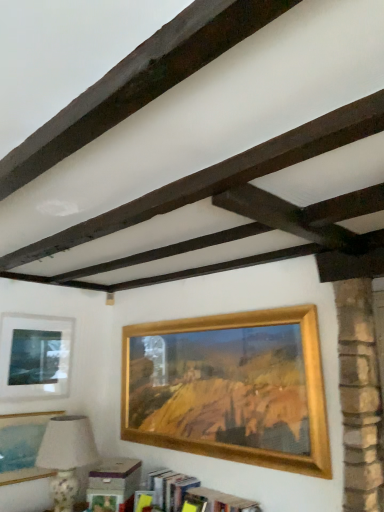
Describe the element at coordinates (118, 487) in the screenshot. I see `wooden bookshelf at lower center` at that location.

In order to face gold wooden picture frame at center, marked as the first picture frame in a right-to-left arrangement, should I rotate leftwards or rightwards?

Turn right approximately 1.000 degrees to face it.

This screenshot has width=384, height=512. Describe the element at coordinates (230, 388) in the screenshot. I see `gold wooden picture frame at center, marked as the first picture frame in a right-to-left arrangement` at that location.

Measure the distance between point (25, 383) and camera.

Point (25, 383) is 3.00 meters from camera.

The width and height of the screenshot is (384, 512). What do you see at coordinates (139, 81) in the screenshot?
I see `dark brown wood at upper center` at bounding box center [139, 81].

What do you see at coordinates (22, 446) in the screenshot? I see `matte gold picture frame at lower left, arranged as the 2th picture frame when viewed from the right` at bounding box center [22, 446].

I want to click on wooden bookshelf at lower center, so click(x=118, y=487).

From the picture: Could you tell me if matte gold picture frame at lower left, arranged as the 2th picture frame when viewed from the right, is facing dark brown wood at upper center?

No, matte gold picture frame at lower left, arranged as the 2th picture frame when viewed from the right, does not turn towards dark brown wood at upper center.

Can you confirm if matte gold picture frame at lower left, arranged as the 2th picture frame when viewed from the right, is positioned to the right of dark brown wood at upper center?

No.

Which of these two, matte gold picture frame at lower left, which is the second picture frame from left to right, or dark brown wood at upper center, is wider?

With larger width is dark brown wood at upper center.

Who is shorter, matte gold picture frame at lower left, which is the second picture frame from left to right, or dark brown wood at upper center?

dark brown wood at upper center is shorter.

Between matte gold picture frame at lower left, arranged as the 2th picture frame when viewed from the right, and wooden bookshelf at lower center, which one has larger size?

wooden bookshelf at lower center.

Which is closer to the camera, (20, 426) or (233, 503)?

Clearly, point (20, 426) is more distant from the camera than point (233, 503).

In the scene shown: Is matte gold picture frame at lower left, which is the second picture frame from left to right, surrounding wooden bookshelf at lower center?

No, wooden bookshelf at lower center is not a part of matte gold picture frame at lower left, which is the second picture frame from left to right.

Could you tell me if matte gold picture frame at lower left, which is the second picture frame from left to right, is turned towards wooden bookshelf at lower center?

Yes.

Is porcelain floral table lamp at lower left oriented away from matte gold picture frame at lower left, arranged as the 2th picture frame when viewed from the right?

No, porcelain floral table lamp at lower left's orientation is not away from matte gold picture frame at lower left, arranged as the 2th picture frame when viewed from the right.

Is porcelain floral table lamp at lower left taller than matte gold picture frame at lower left, arranged as the 2th picture frame when viewed from the right?

Yes, porcelain floral table lamp at lower left is taller than matte gold picture frame at lower left, arranged as the 2th picture frame when viewed from the right.

Is point (54, 504) closer or farther from the camera than point (11, 476)?

Point (54, 504) is closer to the camera than point (11, 476).

From a real-world perspective, is porcelain floral table lamp at lower left located beneath matte gold picture frame at lower left, which is the second picture frame from left to right?

Yes.

Which is behind, point (116, 117) or point (65, 450)?

The point (65, 450) is farther.

The width and height of the screenshot is (384, 512). Find the location of `table lamp below the dark brown wood at upper center (from a real-world perspective)`. table lamp below the dark brown wood at upper center (from a real-world perspective) is located at coordinates (66, 456).

Is porcelain floral table lamp at lower left a part of dark brown wood at upper center?

No, porcelain floral table lamp at lower left is not a part of dark brown wood at upper center.

Does dark brown wood at upper center have a larger size compared to porcelain floral table lamp at lower left?

Incorrect, dark brown wood at upper center is not larger than porcelain floral table lamp at lower left.

From a real-world perspective, between wooden bookshelf at lower center and matte gold picture frame at lower left, arranged as the 2th picture frame when viewed from the right, who is vertically lower?

From a 3D spatial view, wooden bookshelf at lower center is below.

Is wooden bookshelf at lower center bigger than matte gold picture frame at lower left, which is the second picture frame from left to right?

Correct, wooden bookshelf at lower center is larger in size than matte gold picture frame at lower left, which is the second picture frame from left to right.

Is point (242, 511) behind point (35, 477)?

No, it is in front of (35, 477).

What's the angular difference between wooden bookshelf at lower center and matte gold picture frame at lower left, arranged as the 2th picture frame when viewed from the right,'s facing directions?

They differ by 92.6 degrees in their facing directions.

Considering the relative sizes of gold wooden picture frame at center, marked as the first picture frame in a right-to-left arrangement, and matte gold picture frame at lower left, which is the second picture frame from left to right, in the image provided, is gold wooden picture frame at center, marked as the first picture frame in a right-to-left arrangement, wider than matte gold picture frame at lower left, which is the second picture frame from left to right,?

Indeed, gold wooden picture frame at center, marked as the first picture frame in a right-to-left arrangement, has a greater width compared to matte gold picture frame at lower left, which is the second picture frame from left to right.

Looking at this image, which object is more forward, gold wooden picture frame at center, marked as the first picture frame in a right-to-left arrangement, or matte gold picture frame at lower left, which is the second picture frame from left to right?

gold wooden picture frame at center, marked as the first picture frame in a right-to-left arrangement.

Which point is more forward, (188, 396) or (39, 421)?

Point (188, 396)

Does gold wooden picture frame at center, marked as the 3th picture frame in a left-to-right arrangement, have a greater height compared to matte gold picture frame at lower left, which is the second picture frame from left to right?

Yes, gold wooden picture frame at center, marked as the 3th picture frame in a left-to-right arrangement, is taller than matte gold picture frame at lower left, which is the second picture frame from left to right.

From the picture: Is matte glass picture frame at upper left, the third picture frame when ordered from right to left, turned away from dark brown wood at upper center?

No, dark brown wood at upper center is not at the back of matte glass picture frame at upper left, the third picture frame when ordered from right to left.

Considering the sizes of objects matte glass picture frame at upper left, the 1th picture frame from the left, and dark brown wood at upper center in the image provided, who is taller, matte glass picture frame at upper left, the 1th picture frame from the left, or dark brown wood at upper center?

matte glass picture frame at upper left, the 1th picture frame from the left, is taller.

Locate an element on the screen. plank in front of the matte glass picture frame at upper left, the 1th picture frame from the left is located at coordinates (139, 81).

Locate an element on the screen. Image resolution: width=384 pixels, height=512 pixels. plank on the right of matte gold picture frame at lower left, arranged as the 2th picture frame when viewed from the right is located at coordinates (139, 81).

Image resolution: width=384 pixels, height=512 pixels. I want to click on bookcase directly beneath the matte gold picture frame at lower left, arranged as the 2th picture frame when viewed from the right (from a real-world perspective), so click(118, 487).

Looking at the image, which one is located closer to wooden bookshelf at lower center, matte glass picture frame at upper left, the 1th picture frame from the left, or dark brown wood at upper center?

Among the two, matte glass picture frame at upper left, the 1th picture frame from the left, is located nearer to wooden bookshelf at lower center.

Considering their positions, is matte glass picture frame at upper left, the third picture frame when ordered from right to left, positioned further to porcelain floral table lamp at lower left than gold wooden picture frame at center, marked as the 3th picture frame in a left-to-right arrangement?

Among the two, gold wooden picture frame at center, marked as the 3th picture frame in a left-to-right arrangement, is located further to porcelain floral table lamp at lower left.

Based on their spatial positions, is matte glass picture frame at upper left, the third picture frame when ordered from right to left, or matte gold picture frame at lower left, which is the second picture frame from left to right, further from dark brown wood at upper center?

The object further to dark brown wood at upper center is matte gold picture frame at lower left, which is the second picture frame from left to right.

Considering their positions, is matte gold picture frame at lower left, which is the second picture frame from left to right, positioned closer to porcelain floral table lamp at lower left than gold wooden picture frame at center, marked as the first picture frame in a right-to-left arrangement?

Based on the image, matte gold picture frame at lower left, which is the second picture frame from left to right, appears to be nearer to porcelain floral table lamp at lower left.

From the image, which object appears to be nearer to matte gold picture frame at lower left, which is the second picture frame from left to right, dark brown wood at upper center or porcelain floral table lamp at lower left?

porcelain floral table lamp at lower left is closer to matte gold picture frame at lower left, which is the second picture frame from left to right.

Looking at the image, which one is located closer to wooden bookshelf at lower center, matte gold picture frame at lower left, arranged as the 2th picture frame when viewed from the right, or matte glass picture frame at upper left, the 1th picture frame from the left?

The object closer to wooden bookshelf at lower center is matte gold picture frame at lower left, arranged as the 2th picture frame when viewed from the right.

When comparing their distances from gold wooden picture frame at center, marked as the first picture frame in a right-to-left arrangement, does matte gold picture frame at lower left, which is the second picture frame from left to right, or porcelain floral table lamp at lower left seem closer?

Based on the image, porcelain floral table lamp at lower left appears to be nearer to gold wooden picture frame at center, marked as the first picture frame in a right-to-left arrangement.

From the image, which object appears to be nearer to gold wooden picture frame at center, marked as the 3th picture frame in a left-to-right arrangement, porcelain floral table lamp at lower left or dark brown wood at upper center?

The object closer to gold wooden picture frame at center, marked as the 3th picture frame in a left-to-right arrangement, is porcelain floral table lamp at lower left.

Locate an element on the screen. The width and height of the screenshot is (384, 512). table lamp between matte gold picture frame at lower left, arranged as the 2th picture frame when viewed from the right, and wooden bookshelf at lower center from left to right is located at coordinates (66, 456).

The image size is (384, 512). I want to click on bookcase positioned between dark brown wood at upper center and matte gold picture frame at lower left, which is the second picture frame from left to right, from near to far, so click(x=118, y=487).

At what (x,y) coordinates should I click in order to perform the action: click on table lamp between dark brown wood at upper center and matte glass picture frame at upper left, the third picture frame when ordered from right to left, from front to back. Please return your answer as a coordinate pair (x, y). The image size is (384, 512). Looking at the image, I should click on (66, 456).

The width and height of the screenshot is (384, 512). What are the coordinates of `table lamp that lies between dark brown wood at upper center and wooden bookshelf at lower center from top to bottom` in the screenshot? It's located at (66, 456).